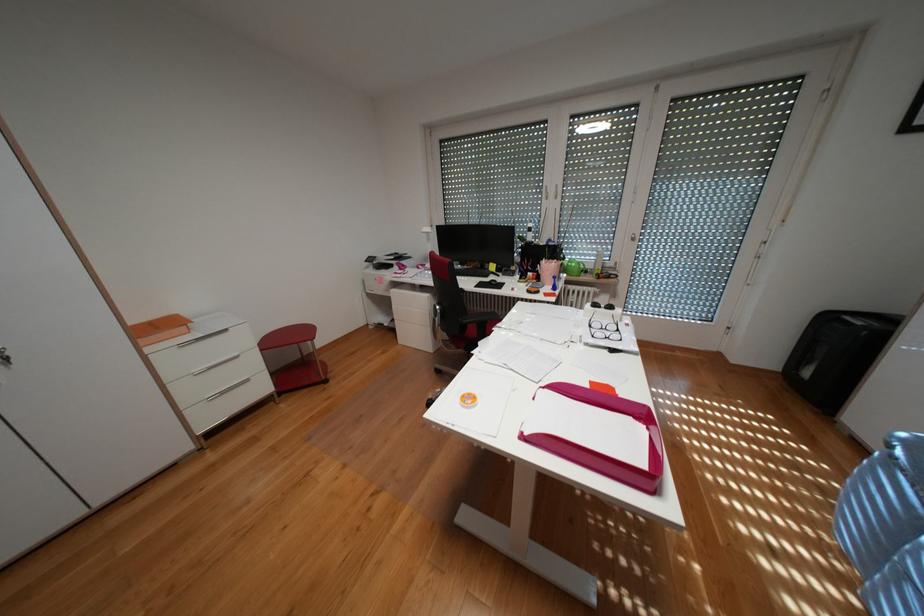
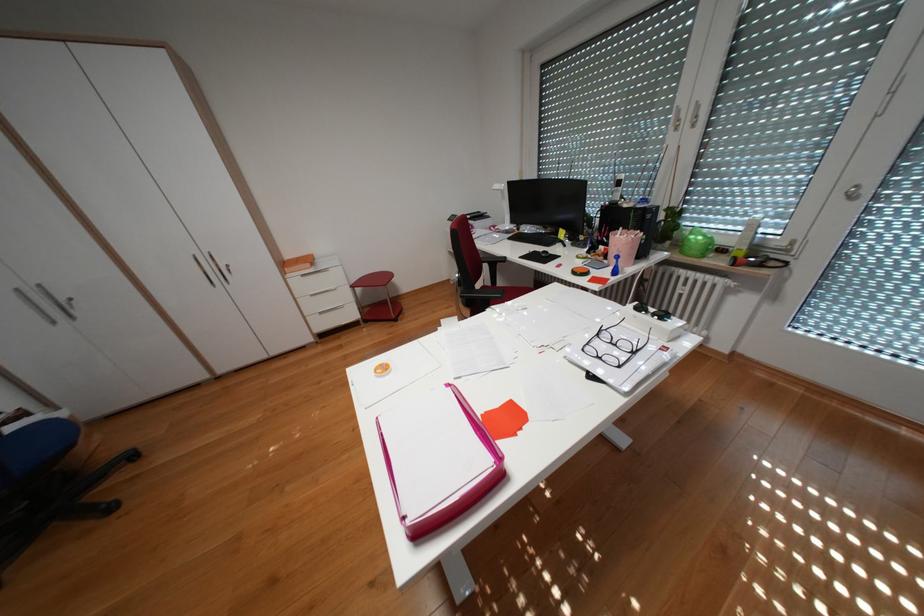
Where in the second image is the point corresponding to (x=561, y=190) from the first image?

(695, 116)